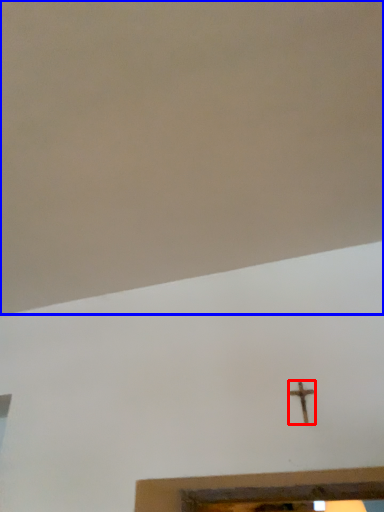
Question: Which object is closer to the camera taking this photo, nail (highlighted by a red box) or backdrop (highlighted by a blue box)?

Choices:
 (A) nail
 (B) backdrop

Answer: (B)